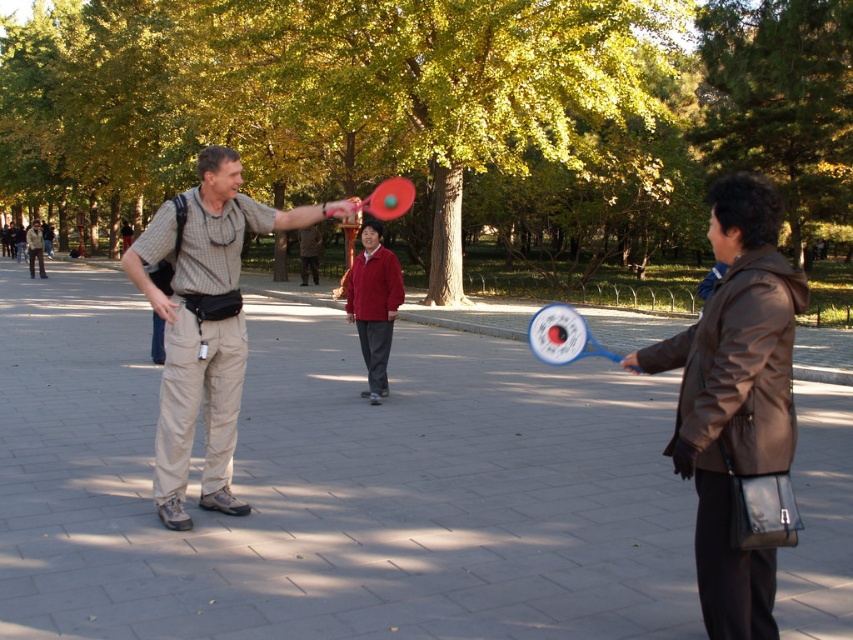
You are standing at the center of the paved area in the park. You see a brown leather jacket at right represented by point (734, 397). Which direction should you walk to reach the brown leather jacket at right?

To reach the brown leather jacket at right represented by point (734, 397), you should walk towards the right direction since the point is located at the right side of the scene.

You are standing at the center of the paved area and want to place a small bench so that it is closer to the brown leather jacket at right than to the edge of the paved area. Can you determine if this is possible?

The brown leather jacket at right is located at point (734, 397). To place a bench closer to it than the edge, the midpoint between the jacket and the edge would be the required distance. Since the coordinates are within the paved area, it is possible to position the bench appropriately.